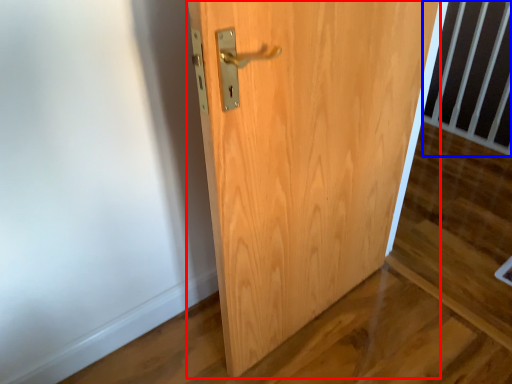
Question: Which point is closer to the camera, door (highlighted by a red box) or balustrade (highlighted by a blue box)?

Choices:
 (A) door
 (B) balustrade

Answer: (A)